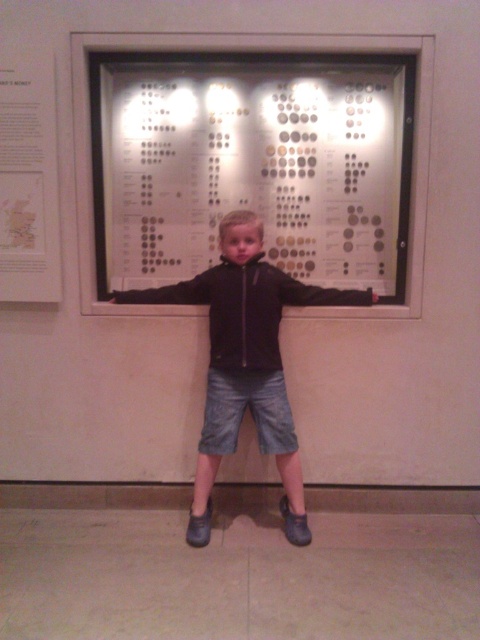
Is metallic coins at center shorter than black matte arm at center?

In fact, metallic coins at center may be taller than black matte arm at center.

Image resolution: width=480 pixels, height=640 pixels. Identify the location of metallic coins at center. (255, 166).

Can you confirm if metallic coins at center is positioned to the right of black leather arm at center?

Indeed, metallic coins at center is positioned on the right side of black leather arm at center.

Is metallic coins at center shorter than black leather arm at center?

Incorrect, metallic coins at center's height does not fall short of black leather arm at center's.

Does point (276, 193) come behind point (196, 291)?

Yes.

Where is `metallic coins at center`? This screenshot has width=480, height=640. metallic coins at center is located at coordinates (255, 166).

Is white paper at upper left to the right of black leather arm at center from the viewer's perspective?

Incorrect, white paper at upper left is not on the right side of black leather arm at center.

Does white paper at upper left have a greater height compared to black leather arm at center?

Yes.

This screenshot has width=480, height=640. What do you see at coordinates (27, 180) in the screenshot?
I see `white paper at upper left` at bounding box center [27, 180].

Locate an element on the screen. The width and height of the screenshot is (480, 640). white paper at upper left is located at coordinates (27, 180).